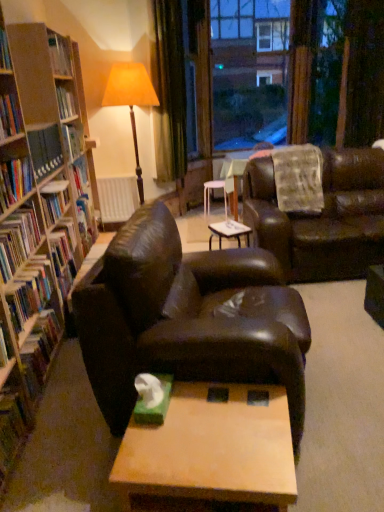
Locate an element on the screen. Image resolution: width=384 pixels, height=512 pixels. free spot above white matte radiator at center (from a real-world perspective) is located at coordinates (110, 175).